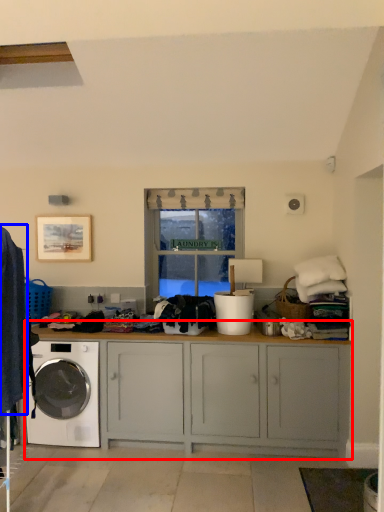
Question: Which object is closer to the camera taking this photo, cabinetry (highlighted by a red box) or clothing (highlighted by a blue box)?

Choices:
 (A) cabinetry
 (B) clothing

Answer: (B)